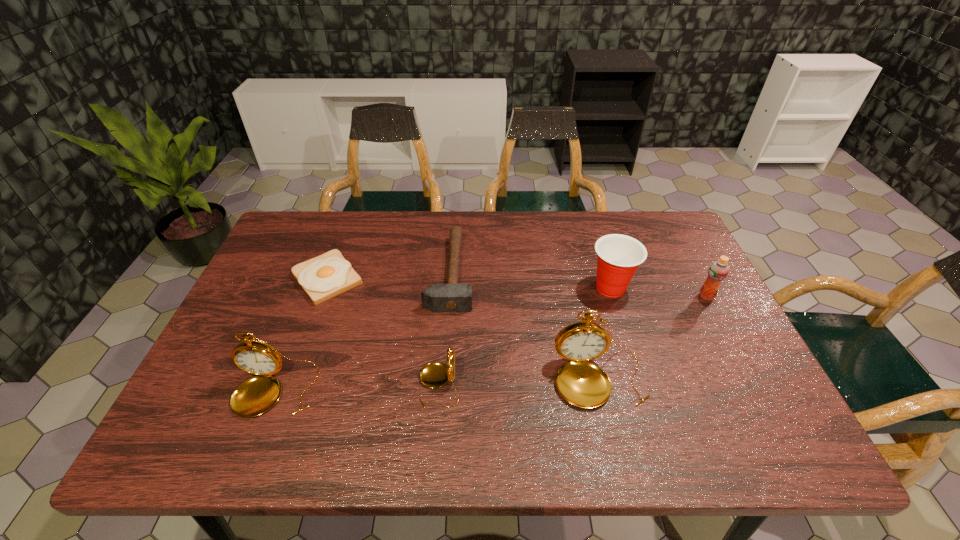
At what (x,y) coordinates should I click in order to perform the action: click on vacant area that satisfies the following two spatial constraints: 1. on the striking surface of the hammer; 2. on the left side of the rightmost object. Please return your answer as a coordinate pair (x, y). The width and height of the screenshot is (960, 540). Looking at the image, I should click on (448, 296).